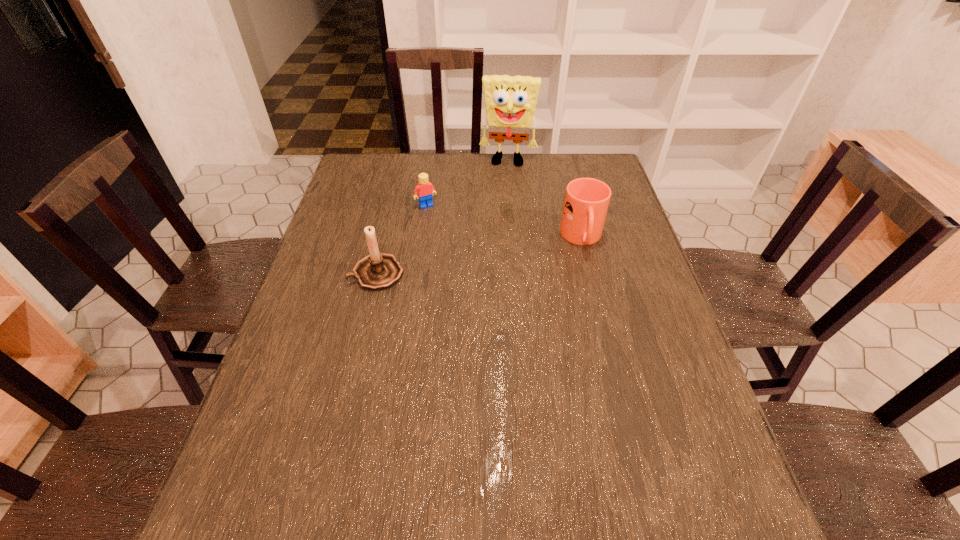
This screenshot has width=960, height=540. Find the location of `candle holder`. candle holder is located at coordinates (378, 271).

This screenshot has height=540, width=960. I want to click on mug, so click(x=586, y=202).

Where is `the third nearest object`? This screenshot has width=960, height=540. the third nearest object is located at coordinates coord(424,189).

I want to click on Lego, so click(x=424, y=189).

Locate an element on the screen. the farthest object is located at coordinates (510, 101).

This screenshot has height=540, width=960. I want to click on sponge, so click(510, 101).

At what (x,y) coordinates should I click in order to perform the action: click on free space located on the back of the candle holder. Please return your answer as a coordinate pair (x, y). Looking at the image, I should click on (388, 230).

You are a GUI agent. You are given a task and a screenshot of the screen. Output one action in this format:
    pyautogui.click(x=<x>, y=<y>)
    Task: Click on the vacant point located on the handle side of the mug
    Image resolution: width=960 pixels, height=540 pixels.
    Given the screenshot: What is the action you would take?
    pyautogui.click(x=596, y=295)

Locate an element on the screen. The width and height of the screenshot is (960, 540). free space located 0.110m on the face of the Lego is located at coordinates (443, 229).

Find the location of a particular element. Image resolution: width=960 pixels, height=540 pixels. free space located 0.060m on the face of the Lego is located at coordinates (437, 220).